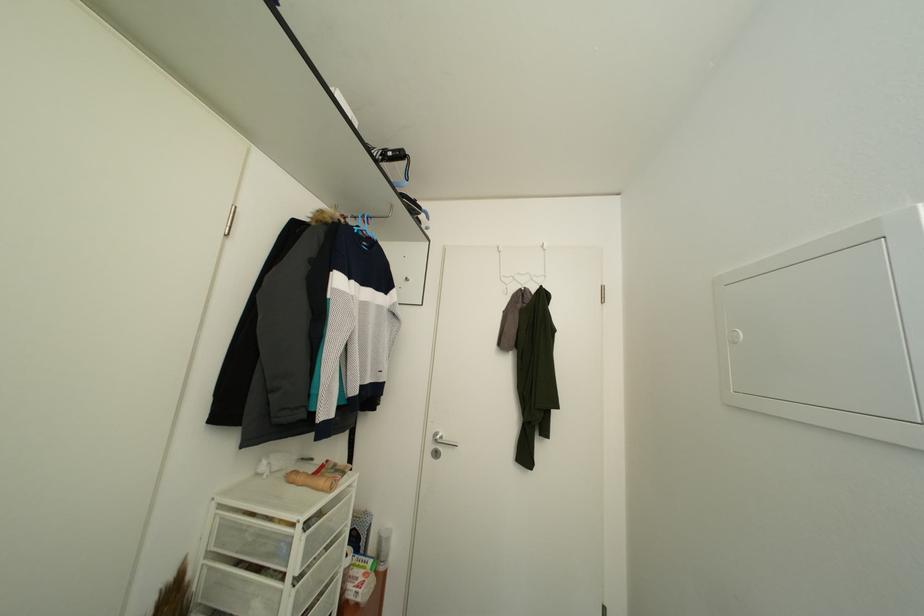
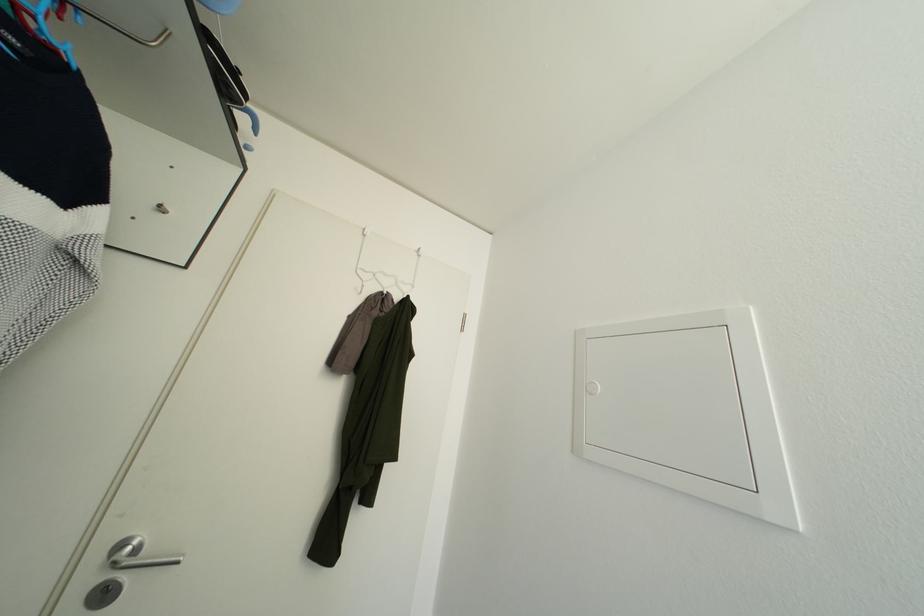
In the second image, find the point that corresponds to point 508,284 in the first image.

(366, 277)